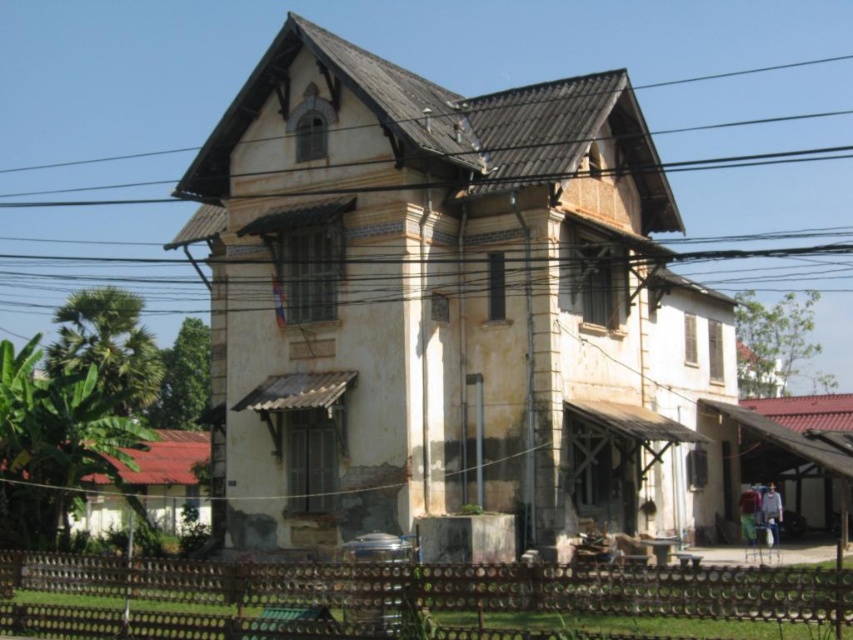
Question: Is brown wooden fence at lower center further to the viewer compared to brown wire at upper center?

Choices:
 (A) no
 (B) yes

Answer: (A)

Question: Is brown wooden fence at lower center closer to the viewer compared to brown wire at upper center?

Choices:
 (A) no
 (B) yes

Answer: (B)

Question: Considering the relative positions of brown wooden fence at lower center and brown wire at upper center in the image provided, where is brown wooden fence at lower center located with respect to brown wire at upper center?

Choices:
 (A) right
 (B) left

Answer: (B)